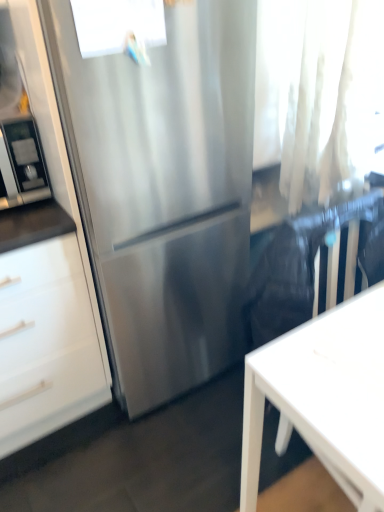
Question: From their relative heights in the image, would you say white sheer curtain at upper right is taller or shorter than stainless steel refrigerator at left?

Choices:
 (A) tall
 (B) short

Answer: (A)

Question: Looking at the image, does white sheer curtain at upper right seem bigger or smaller compared to stainless steel refrigerator at left?

Choices:
 (A) big
 (B) small

Answer: (A)

Question: Which of these objects is positioned farthest from the stainless steel refrigerator at center?

Choices:
 (A) white sheer curtain at upper right
 (B) stainless steel refrigerator at left
 (C) transparent glass window at upper center
 (D) white matte desk at lower right

Answer: (D)

Question: Which is nearer to the white matte desk at lower right?

Choices:
 (A) stainless steel refrigerator at center
 (B) stainless steel refrigerator at left
 (C) white sheer curtain at upper right
 (D) transparent glass window at upper center

Answer: (A)